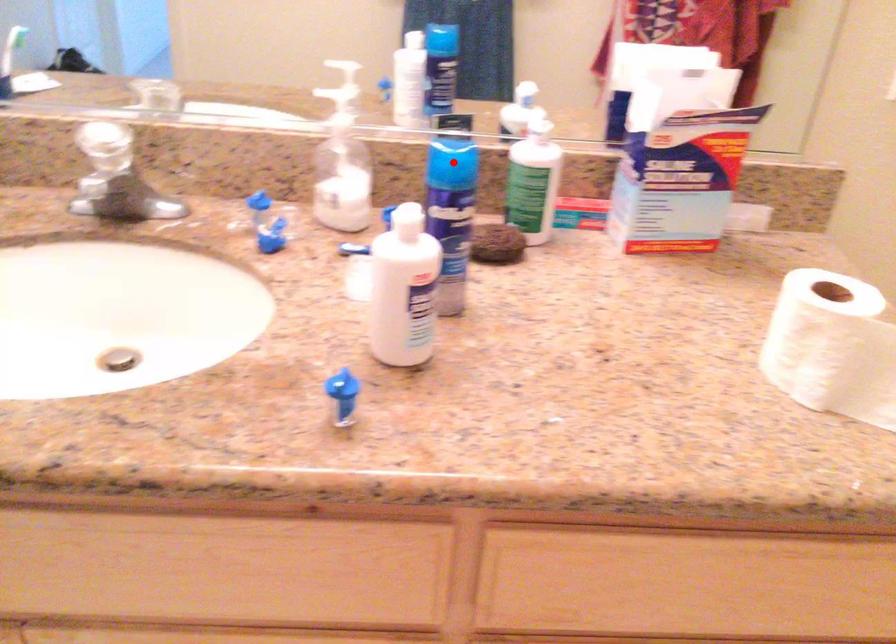
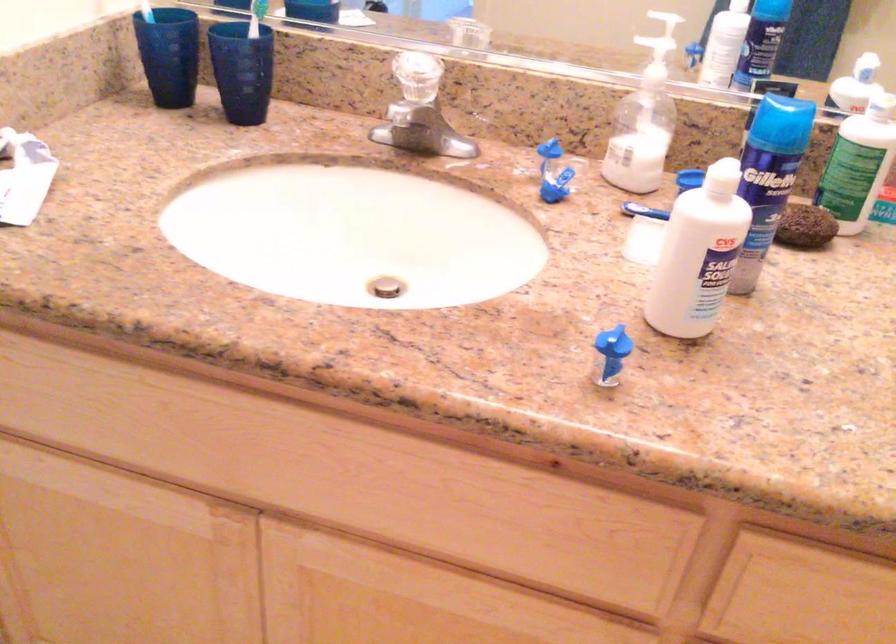
Question: A red point is marked in image1. In image2, is the corresponding 3D point closer to the camera or farther? Reply with the corresponding letter.

Choices:
 (A) The corresponding 3D point is closer.
 (B) The corresponding 3D point is farther.

Answer: (A)